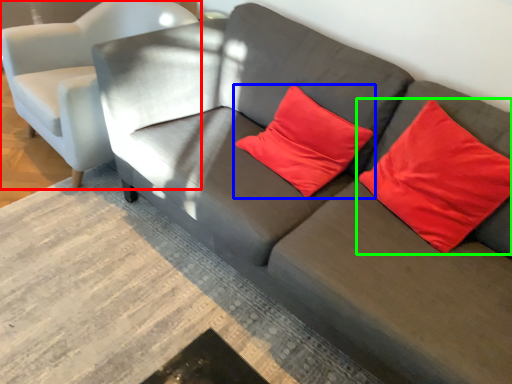
Question: Which object is positioned farthest from chair (highlighted by a red box)? Select from pillow (highlighted by a blue box) and pillow (highlighted by a green box).

Choices:
 (A) pillow
 (B) pillow

Answer: (B)